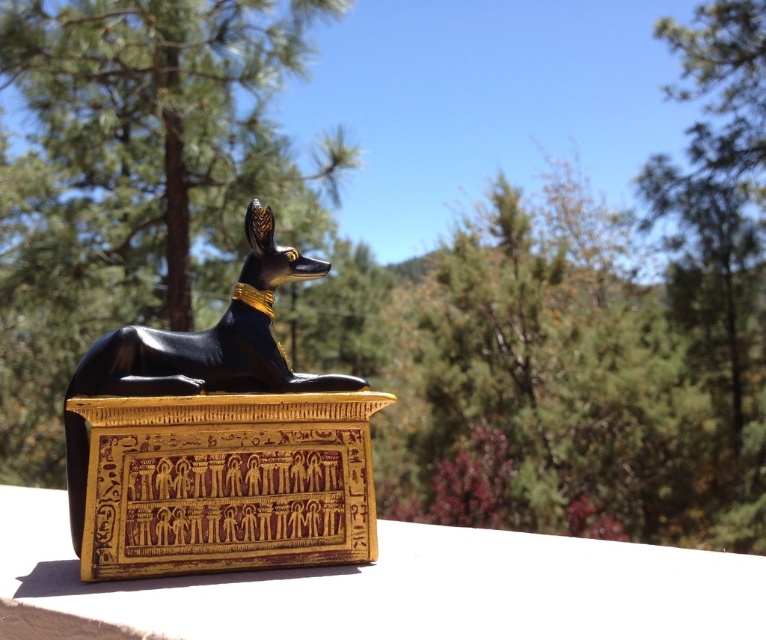
You are an archaeologist examining the scene. You need to document the exact position of the black glossy statue at center. What are its coordinates?

The black glossy statue at center is located at coordinates (218, 442).

You are an archaeologist examining the scene. You need to place a protective cover over the black glossy statue at center and the matte gold box at center. Which object should you cover first if you want to start from the left side of the scene?

The matte gold box at center should be covered first since the black glossy statue at center is to the right of it, meaning the matte gold box is on the left side.

Looking at this image, you are an archaeologist examining the scene. You need to determine if the black glossy statue at center can be placed on top of the matte gold box at center without falling off. What should you consider based on their sizes?

The black glossy statue at center is smaller than the matte gold box at center. Since the statue is smaller, it can be placed on top of the matte gold box at center without falling off as long as it is centered properly.